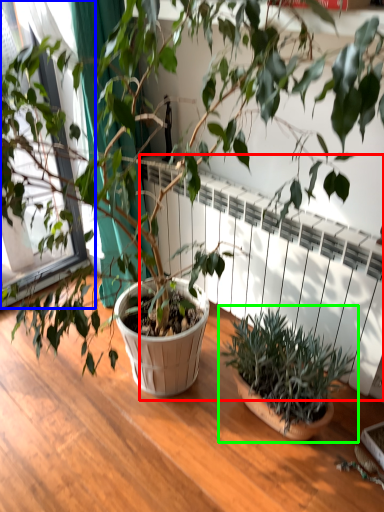
Question: Estimate the real-world distances between objects in this image. Which object is farther from radiator (highlighted by a red box), window frame (highlighted by a blue box) or houseplant (highlighted by a green box)?

Choices:
 (A) window frame
 (B) houseplant

Answer: (A)